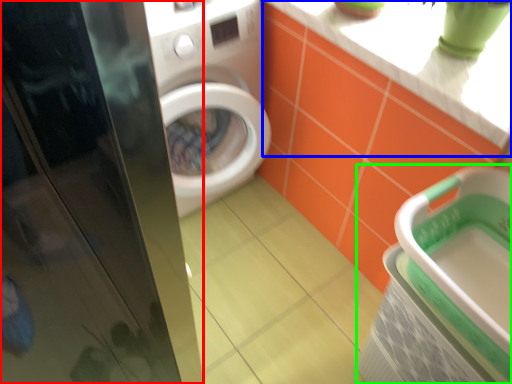
Question: Considering the real-world distances, which object is farthest from screen door (highlighted by a red box)? counter top (highlighted by a blue box) or dish washer (highlighted by a green box)?

Choices:
 (A) counter top
 (B) dish washer

Answer: (A)